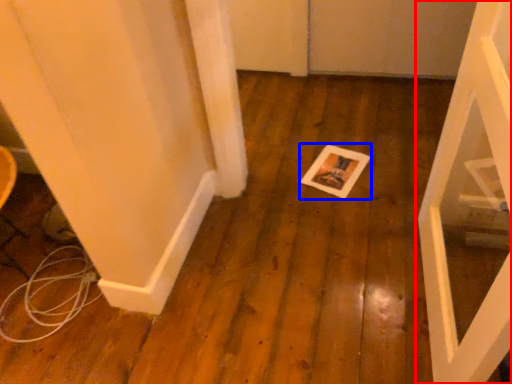
Question: Which point is further to the camera, door (highlighted by a red box) or postcard (highlighted by a blue box)?

Choices:
 (A) door
 (B) postcard

Answer: (B)